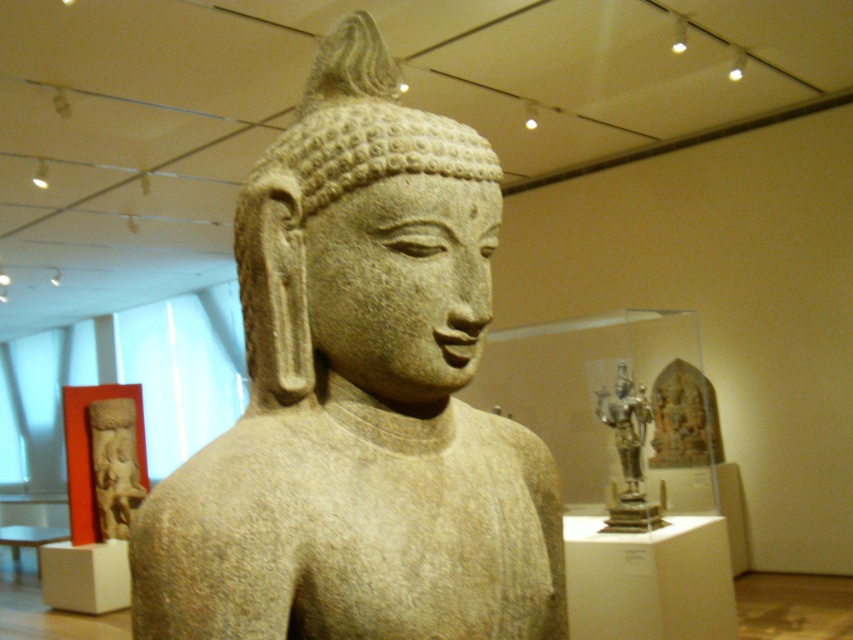
You are a tour guide explaining the layout of the museum exhibit. You mention both the granite statue at center and the carved stone figure at left. Which one is located to the right of the other?

The granite statue at center is positioned on the right side of the carved stone figure at left, meaning the granite statue at center is to the right of the carved stone figure at left.

You are a visitor in the museum and want to take a photo of the sculpture. You are standing at point (625, 529). Can you see the point (106, 408) from your current position?

Point (106, 408) is behind point (625, 529), so you cannot see the point (106, 408) from your current position at point (625, 529).

You are a tour guide standing in front of the granite statue at center. You want to ensure visitors can view the intricate details of the statue without getting too close. Considering the space between you and the statue, what is the minimum distance you should maintain to allow visitors to see the details clearly?

The granite statue at center is 23.44 inches away from the viewer. To ensure visitors can view the intricate details without getting too close, the minimum distance should be at least 23.44 inches, maintaining the current space between the tour guide and the statue.